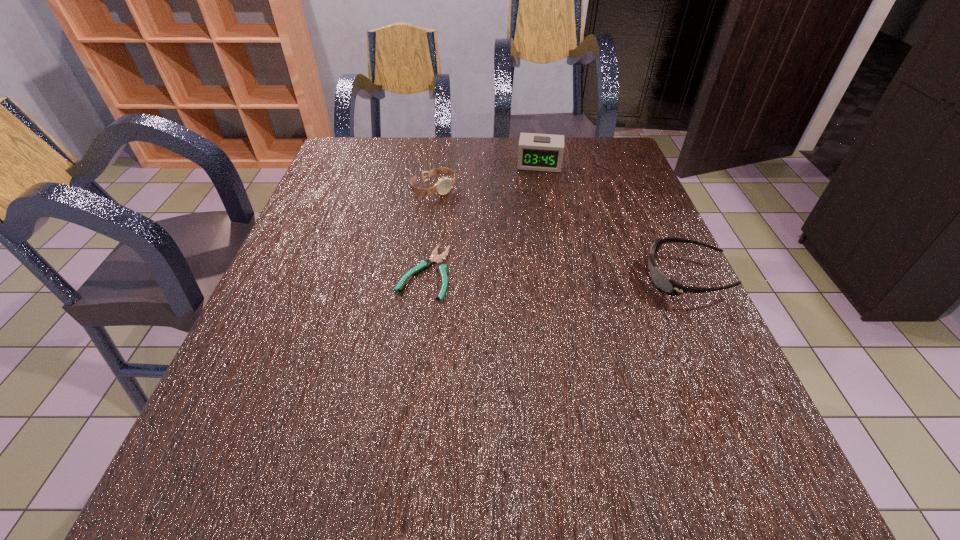
Locate an element on the screen. The width and height of the screenshot is (960, 540). unoccupied area between the watch and the tallest object is located at coordinates (x=487, y=177).

Locate an element on the screen. The height and width of the screenshot is (540, 960). free space between the tallest object and the third nearest object is located at coordinates (487, 177).

This screenshot has height=540, width=960. In order to click on object that can be found as the second closest to the rightmost object in this screenshot , I will do [435, 258].

Select which object appears as the closest to the watch. Please provide its 2D coordinates. Your answer should be formatted as a tuple, i.e. [(x, y)], where the tuple contains the x and y coordinates of a point satisfying the conditions above.

[(538, 152)]

Find the location of a particular element. vacant area that satisfies the following two spatial constraints: 1. on the front side of the watch; 2. on the right side of the pliers is located at coordinates (422, 272).

This screenshot has height=540, width=960. What are the coordinates of `free space that satisfies the following two spatial constraints: 1. on the front side of the second farthest object; 2. on the lenses of the sunglasses` in the screenshot? It's located at [421, 277].

Locate an element on the screen. Image resolution: width=960 pixels, height=540 pixels. free point that satisfies the following two spatial constraints: 1. on the front side of the shortest object; 2. on the right side of the second farthest object is located at coordinates (422, 272).

You are a GUI agent. You are given a task and a screenshot of the screen. Output one action in this format:
    pyautogui.click(x=<x>, y=<y>)
    Task: Click on the blank area in the image that satisfies the following two spatial constraints: 1. on the back side of the alarm clock; 2. on the right side of the pliers
    This screenshot has height=540, width=960.
    Given the screenshot: What is the action you would take?
    pyautogui.click(x=438, y=165)

Identify the location of blank space that satisfies the following two spatial constraints: 1. on the front side of the sunglasses; 2. on the lenses of the watch. (421, 277).